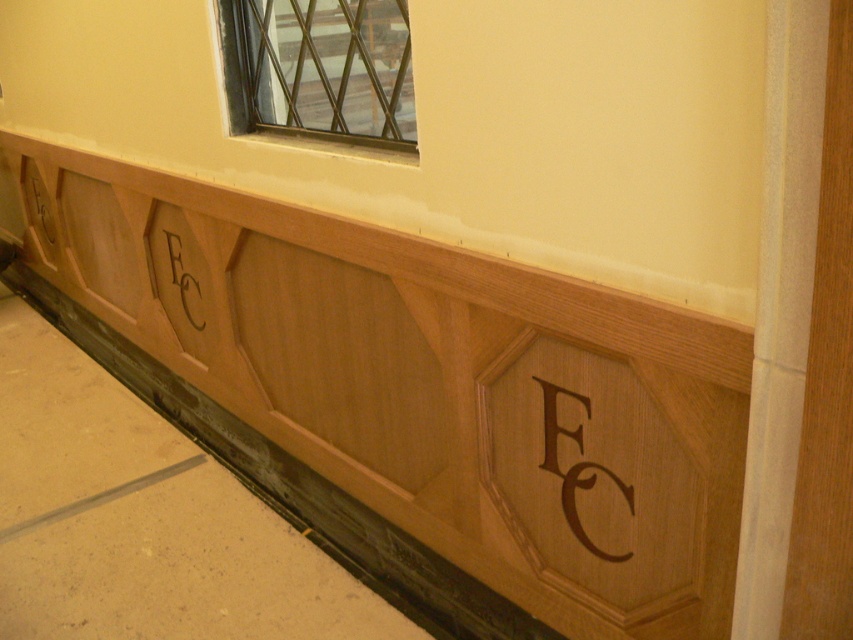
Is metallic grid at upper center behind brown wood lettering at center?

Yes, it is.

Who is more distant from viewer, (x=300, y=65) or (x=572, y=524)?

Positioned behind is point (x=300, y=65).

Find the location of a particular element. metallic grid at upper center is located at coordinates (320, 72).

Which is below, metallic grid at upper center or black wood lettering at center?

Positioned lower is black wood lettering at center.

Between point (335, 138) and point (190, 278), which one is positioned behind?

The point (190, 278) is more distant.

Identify the location of metallic grid at upper center. Image resolution: width=853 pixels, height=640 pixels. (320, 72).

Is brown wood lettering at center above black wood lettering at center?

No.

Which of these two, brown wood lettering at center or black wood lettering at center, stands taller?

Standing taller between the two is brown wood lettering at center.

Who is more forward, (630, 493) or (196, 284)?

Point (630, 493)

Locate an element on the screen. The width and height of the screenshot is (853, 640). brown wood lettering at center is located at coordinates (575, 467).